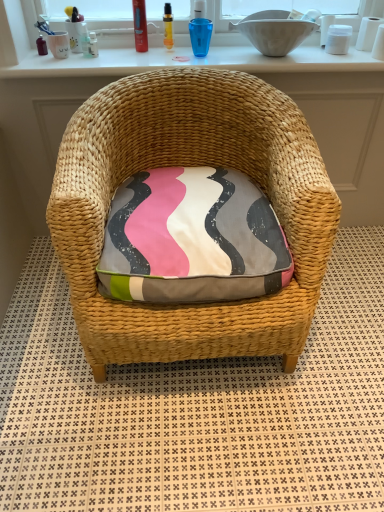
I want to click on vacant area on top of woven straw chair at center (from a real-world perspective), so click(221, 382).